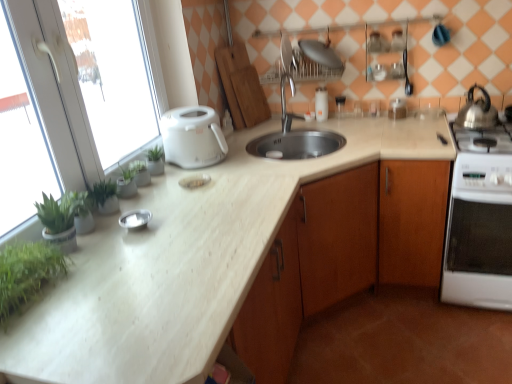
Image resolution: width=512 pixels, height=384 pixels. Identify the location of vacant region in front of white plastic toaster at left, the 1th kitchen appliance in the left-to-right sequence. (206, 176).